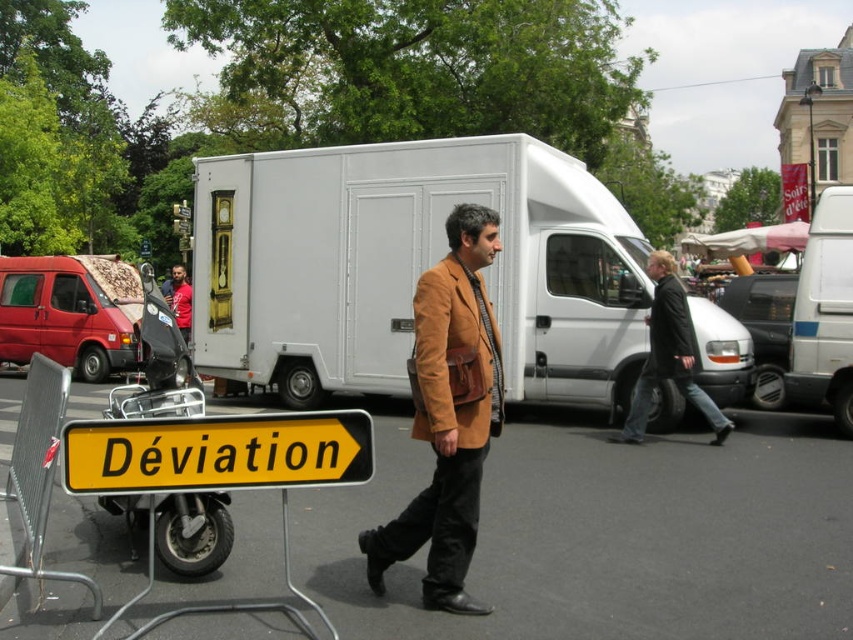
Between suede brown jacket at center and white matte van at center-right, which one appears on the left side from the viewer's perspective?

Positioned to the left is suede brown jacket at center.

What are the coordinates of `suede brown jacket at center` in the screenshot? It's located at (456, 356).

Is yellowmaterial/texturesign at lower center bigger than white matte van at center-right?

Actually, yellowmaterial/texturesign at lower center might be smaller than white matte van at center-right.

In the scene shown: Is yellowmaterial/texturesign at lower center thinner than white matte van at center-right?

In fact, yellowmaterial/texturesign at lower center might be wider than white matte van at center-right.

Describe the element at coordinates (218, 452) in the screenshot. I see `yellowmaterial/texturesign at lower center` at that location.

This screenshot has width=853, height=640. Find the location of `yellowmaterial/texturesign at lower center`. yellowmaterial/texturesign at lower center is located at coordinates (218, 452).

Between point (50, 284) and point (683, 339), which one is positioned in front?

Point (683, 339) is more forward.

Is point (120, 312) less distant than point (641, 380)?

No, (120, 312) is further to viewer.

Which is behind, point (10, 280) or point (664, 262)?

Positioned behind is point (10, 280).

The height and width of the screenshot is (640, 853). Find the location of `matte red van at left`. matte red van at left is located at coordinates (70, 312).